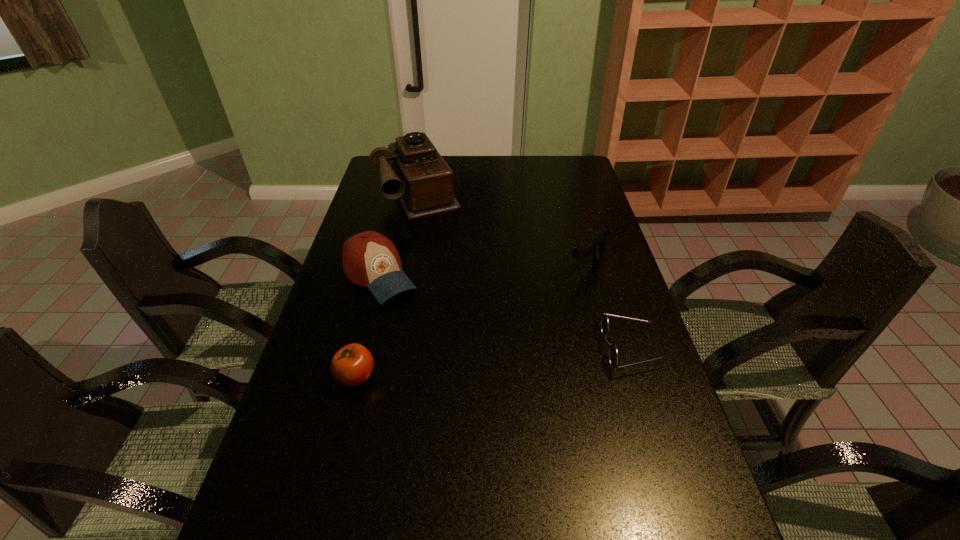
You are a GUI agent. You are given a task and a screenshot of the screen. Output one action in this format:
    pyautogui.click(x=<x>, y=<y>)
    Task: Click on the apple
    Image resolution: width=960 pixels, height=540 pixels.
    Given the screenshot: What is the action you would take?
    pyautogui.click(x=352, y=365)

What are the coordinates of `the shortest object` in the screenshot? It's located at [613, 355].

Image resolution: width=960 pixels, height=540 pixels. Find the location of `pistol`. pistol is located at coordinates (594, 245).

The height and width of the screenshot is (540, 960). Identify the location of the tallest object. (421, 179).

Find the location of `phonograph_record`. phonograph_record is located at coordinates (421, 179).

Locate an element on the screen. baseball cap is located at coordinates (370, 259).

Locate an element on the screen. blank area located on the back of the apple is located at coordinates (370, 323).

This screenshot has height=540, width=960. I want to click on vacant region located 0.110m on the front-facing side of the pistol, so click(553, 295).

Identify the location of free space located on the front-facing side of the pistol. (560, 291).

Image resolution: width=960 pixels, height=540 pixels. I want to click on vacant space located on the front-facing side of the pistol, so click(x=504, y=336).